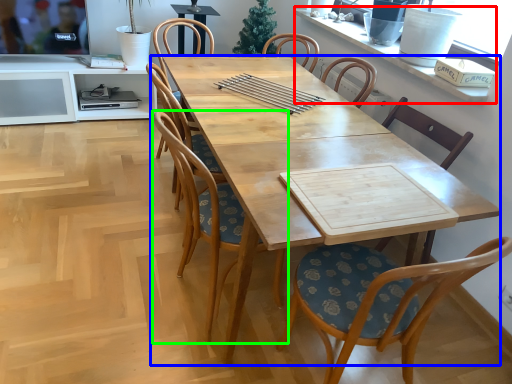
Question: Which object is the farthest from window sill (highlighted by a red box)? Choose among these: desk (highlighted by a blue box) or chair (highlighted by a green box).

Choices:
 (A) desk
 (B) chair

Answer: (B)